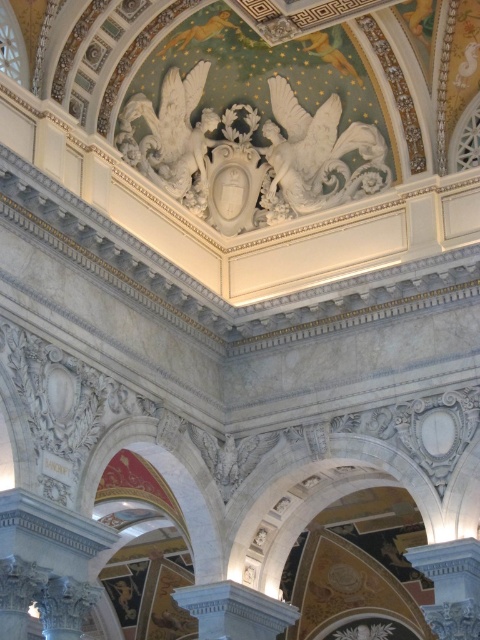
Who is positioned more to the right, white marble sculpture at upper center or white marble column at lower right?

Positioned to the right is white marble column at lower right.

I want to click on white marble sculpture at upper center, so click(169, 132).

This screenshot has height=640, width=480. What are the coordinates of `white marble sculpture at upper center` in the screenshot? It's located at (169, 132).

Is white marble eagle at upper center wider than white marble column at lower right?

Correct, the width of white marble eagle at upper center exceeds that of white marble column at lower right.

Does white marble eagle at upper center appear over white marble column at lower right?

Yes.

The image size is (480, 640). I want to click on white marble eagle at upper center, so click(x=319, y=154).

Is white marble eagle at upper center smaller than white marble column at center?

Indeed, white marble eagle at upper center has a smaller size compared to white marble column at center.

Can you confirm if white marble eagle at upper center is taller than white marble column at center?

In fact, white marble eagle at upper center may be shorter than white marble column at center.

Which is behind, point (369, 168) or point (232, 605)?

Point (369, 168)

At what (x,y) coordinates should I click in order to perform the action: click on white marble eagle at upper center. Please return your answer as a coordinate pair (x, y). Image resolution: width=480 pixels, height=640 pixels. Looking at the image, I should click on (319, 154).